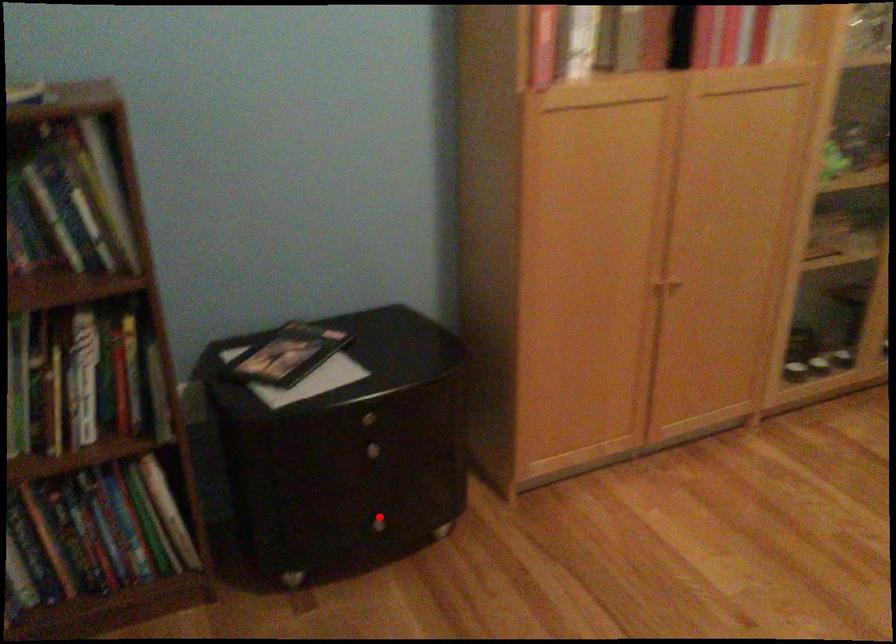
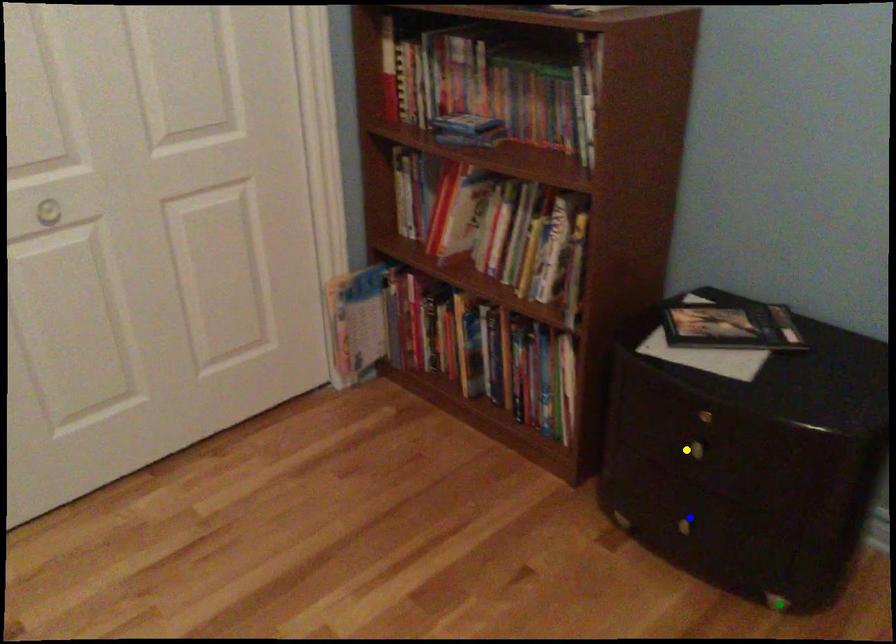
Question: I am providing you with two images of the same scene from different viewpoints. A red point is marked on the first image. You are given multiple points on the second image. Can you choose the point in image 2 that corresponds to the point in image 1?

Choices:
 (A) yellow point
 (B) green point
 (C) blue point

Answer: (C)